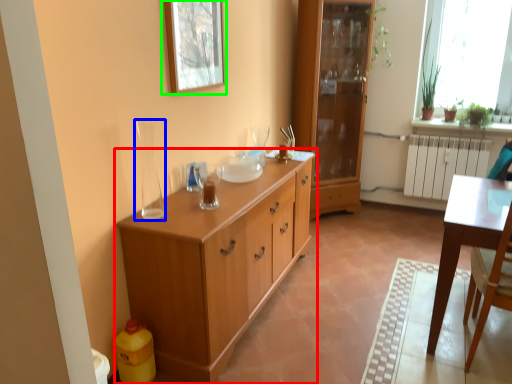
Question: Which object is positioned closest to chest of drawers (highlighted by a red box)? Select from glass vase (highlighted by a blue box) and picture frame (highlighted by a green box).

Choices:
 (A) glass vase
 (B) picture frame

Answer: (A)